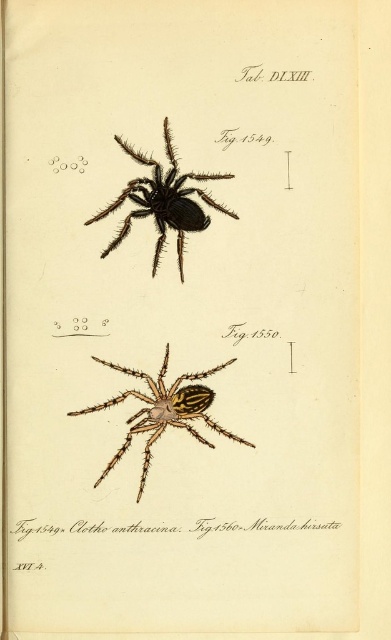
From the picture: Is black matte spider at upper center further to the viewer compared to yellow-striped silk spider at center?

Yes, it is.

Is black matte spider at upper center above yellow-striped silk spider at center?

Yes, black matte spider at upper center is above yellow-striped silk spider at center.

Which is in front, point (173, 182) or point (129, 392)?

Point (173, 182)

At what (x,y) coordinates should I click in order to perform the action: click on black matte spider at upper center. Please return your answer as a coordinate pair (x, y). The width and height of the screenshot is (391, 640). Looking at the image, I should click on (163, 202).